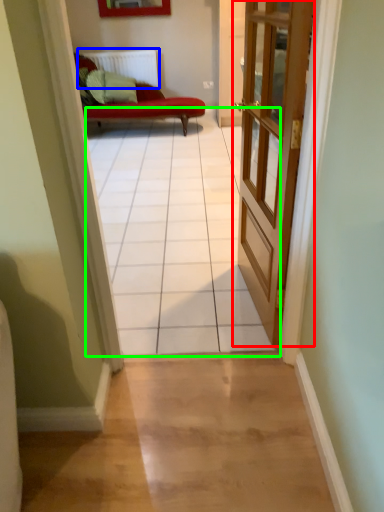
Question: Which object is the closest to the door (highlighted by a red box)? Choose among these: radiator (highlighted by a blue box) or path (highlighted by a green box).

Choices:
 (A) radiator
 (B) path

Answer: (B)